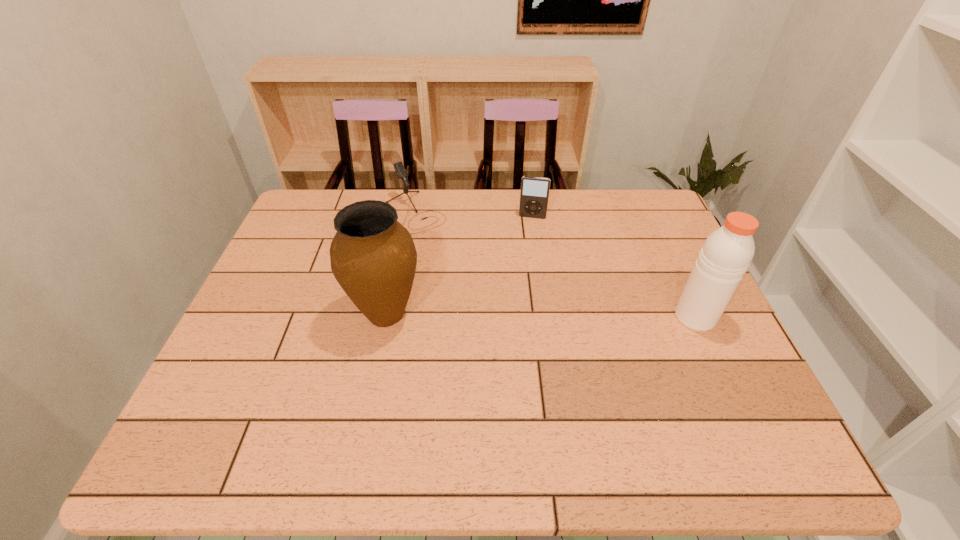
The width and height of the screenshot is (960, 540). I want to click on free spot located 0.400m on the stand of the microphone, so click(505, 312).

You are a GUI agent. You are given a task and a screenshot of the screen. Output one action in this format:
    pyautogui.click(x=<x>, y=<y>)
    Task: Click on the vacant point located 0.400m on the stand of the microphone
    The width and height of the screenshot is (960, 540).
    Given the screenshot: What is the action you would take?
    pyautogui.click(x=505, y=312)

This screenshot has height=540, width=960. Identify the location of iPod that is at the far edge. (534, 194).

Find the location of a particular element. microphone that is at the far edge is located at coordinates (401, 172).

The height and width of the screenshot is (540, 960). What are the coordinates of `object that is at the right edge` in the screenshot? It's located at (726, 254).

Where is `vacant space at the far edge of the desktop`? vacant space at the far edge of the desktop is located at coordinates (433, 225).

Where is `vacant area at the near edge of the desktop`? The width and height of the screenshot is (960, 540). vacant area at the near edge of the desktop is located at coordinates (416, 415).

The height and width of the screenshot is (540, 960). In order to click on free space at the left edge of the desktop in this screenshot , I will do `click(223, 358)`.

This screenshot has height=540, width=960. In the image, there is a desktop. Find the location of `free space at the right edge`. free space at the right edge is located at coordinates (702, 377).

This screenshot has height=540, width=960. I want to click on vacant space at the far left corner of the desktop, so tap(291, 225).